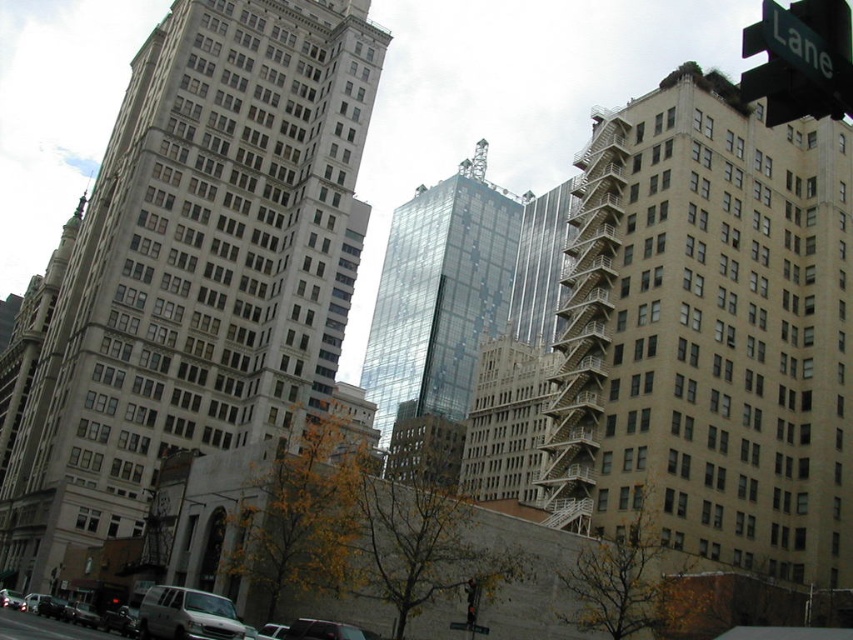
You are a city planner reviewing this area and need to assess visibility of the green plastic street sign at upper right. Considering the transparent glass building at center, will the sign be easily visible to drivers approaching from the street? Please explain.

The transparent glass building at center is larger than the green plastic street sign at upper right, so it may obstruct the view of the sign for drivers approaching from the street.

You are a delivery person trying to navigate through the street. You see the beige concrete fire escape at right and the silver metallic van at lower left. Which object is closer to you as you stand at the street corner?

The beige concrete fire escape at right is closer to you because it is in front of the silver metallic van at lower left, indicating it is nearer in the line of sight.